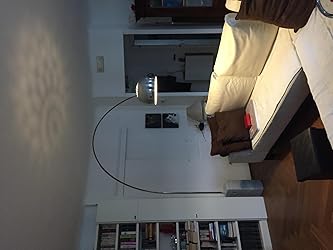
You are a GUI agent. You are given a task and a screenshot of the screen. Output one action in this format:
    pyautogui.click(x=<x>, y=<y>)
    Task: Click on the wall pictures
    
    Given the screenshot: What is the action you would take?
    pyautogui.click(x=167, y=123)